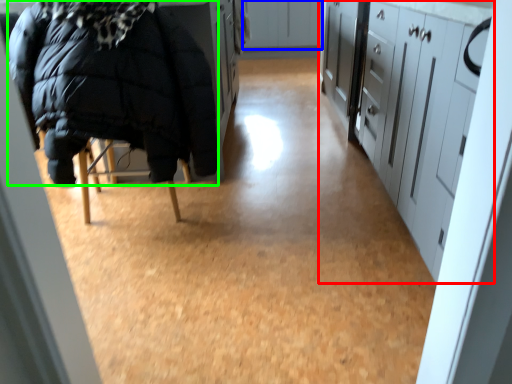
Question: Based on their relative distances, which object is farther from cabinetry (highlighted by a red box)? Choose from cabinetry (highlighted by a blue box) and jacket (highlighted by a green box).

Choices:
 (A) cabinetry
 (B) jacket

Answer: (A)